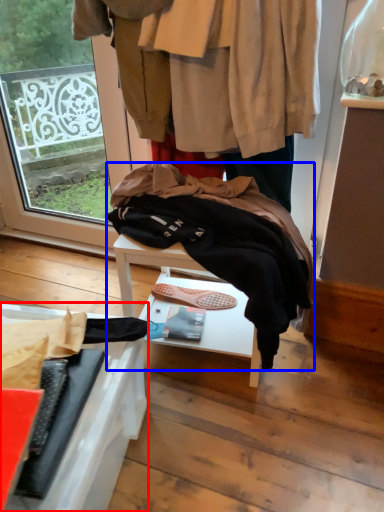
Question: Among these objects, which one is farthest to the camera, furniture (highlighted by a red box) or wool (highlighted by a blue box)?

Choices:
 (A) furniture
 (B) wool

Answer: (B)